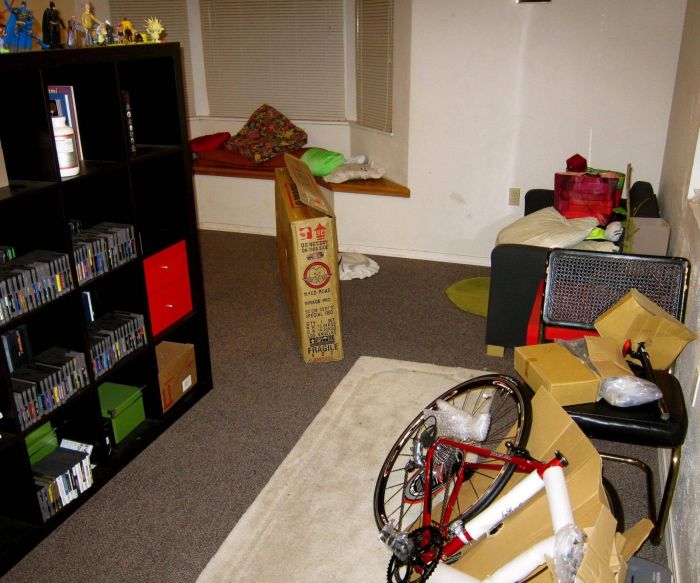
Identify the location of brown flooring. (224, 431).